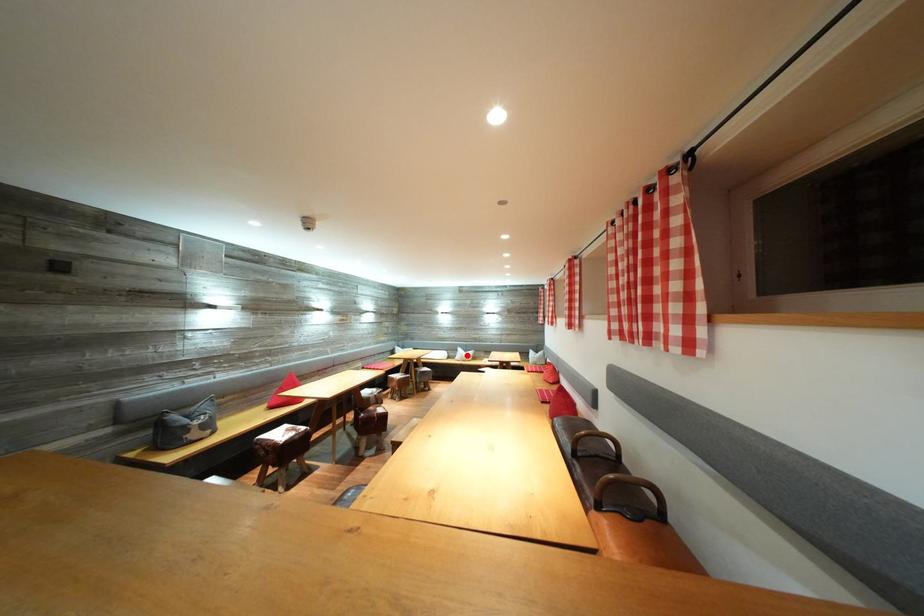
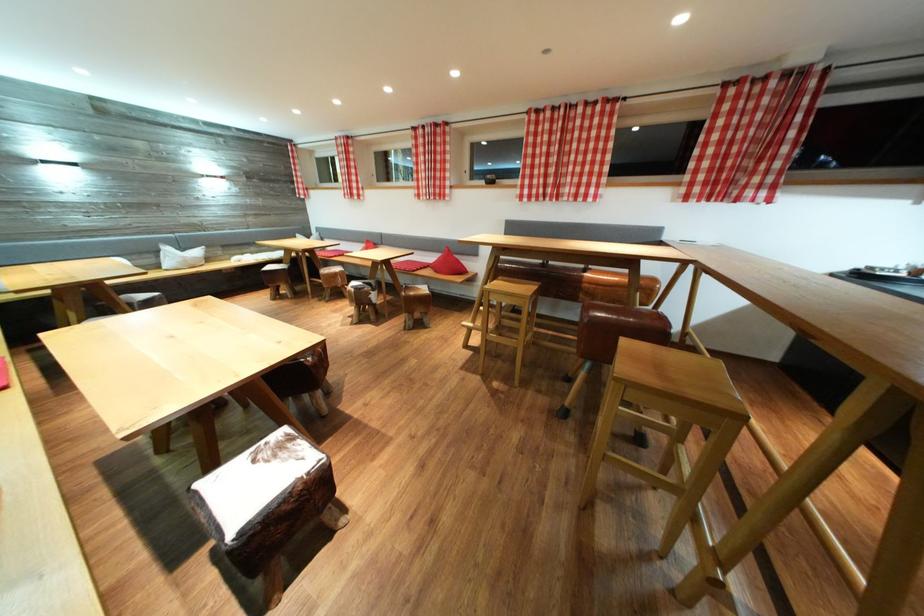
In the second image, find the point that corresponds to the highlighted location in the first image.

(176, 254)